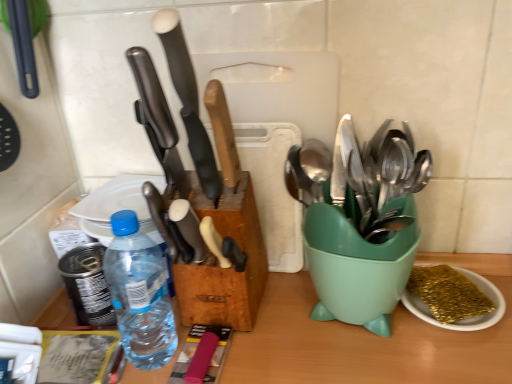
Question: Does polished black knife at center, the first kitchen knife viewed from the left, have a greater height compared to matte black knife at center, which is the 2th kitchen knife from right to left?

Choices:
 (A) no
 (B) yes

Answer: (A)

Question: Does polished black knife at center, acting as the third kitchen knife starting from the right, touch matte black knife at center, which appears as the 2th kitchen knife when viewed from the left?

Choices:
 (A) no
 (B) yes

Answer: (B)

Question: From the image's perspective, is polished black knife at center, the first kitchen knife viewed from the left, on top of matte black knife at center, which is the 2th kitchen knife from right to left?

Choices:
 (A) yes
 (B) no

Answer: (B)

Question: Is polished black knife at center, the first kitchen knife viewed from the left, oriented towards matte black knife at center, which appears as the 2th kitchen knife when viewed from the left?

Choices:
 (A) yes
 (B) no

Answer: (B)

Question: Does polished black knife at center, acting as the third kitchen knife starting from the right, have a smaller size compared to matte black knife at center, which appears as the 2th kitchen knife when viewed from the left?

Choices:
 (A) no
 (B) yes

Answer: (B)

Question: From the image's perspective, is gold glitter sponge at lower right positioned above or below white plastic plate at upper left?

Choices:
 (A) above
 (B) below

Answer: (B)

Question: Is gold glitter sponge at lower right spatially inside white plastic plate at upper left, or outside of it?

Choices:
 (A) inside
 (B) outside

Answer: (B)

Question: Is gold glitter sponge at lower right taller or shorter than white plastic plate at upper left?

Choices:
 (A) short
 (B) tall

Answer: (B)

Question: Is gold glitter sponge at lower right in front of or behind white plastic plate at upper left in the image?

Choices:
 (A) behind
 (B) front

Answer: (B)

Question: From the image's perspective, relative to gold glitter sponge at lower right, is matte black knife at center, which appears as the 2th kitchen knife when viewed from the left, above or below?

Choices:
 (A) above
 (B) below

Answer: (A)

Question: Considering their positions, is matte black knife at center, which is the 2th kitchen knife from right to left, located in front of or behind gold glitter sponge at lower right?

Choices:
 (A) behind
 (B) front

Answer: (B)

Question: From their relative heights in the image, would you say matte black knife at center, which is the 2th kitchen knife from right to left, is taller or shorter than gold glitter sponge at lower right?

Choices:
 (A) tall
 (B) short

Answer: (A)

Question: Is matte black knife at center, which is the 2th kitchen knife from right to left, wider or thinner than gold glitter sponge at lower right?

Choices:
 (A) thin
 (B) wide

Answer: (A)

Question: From a real-world perspective, is wooden-handled knife at center, arranged as the first kitchen knife when viewed from the right, positioned above or below white plastic plate at upper left?

Choices:
 (A) above
 (B) below

Answer: (A)

Question: From the image's perspective, is wooden-handled knife at center, acting as the 3th kitchen knife starting from the left, positioned above or below white plastic plate at upper left?

Choices:
 (A) below
 (B) above

Answer: (B)